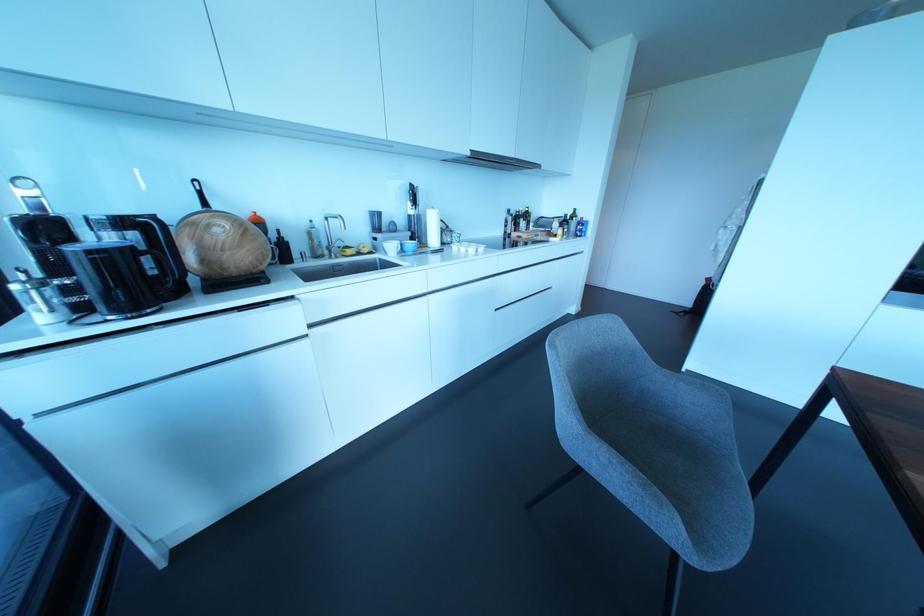
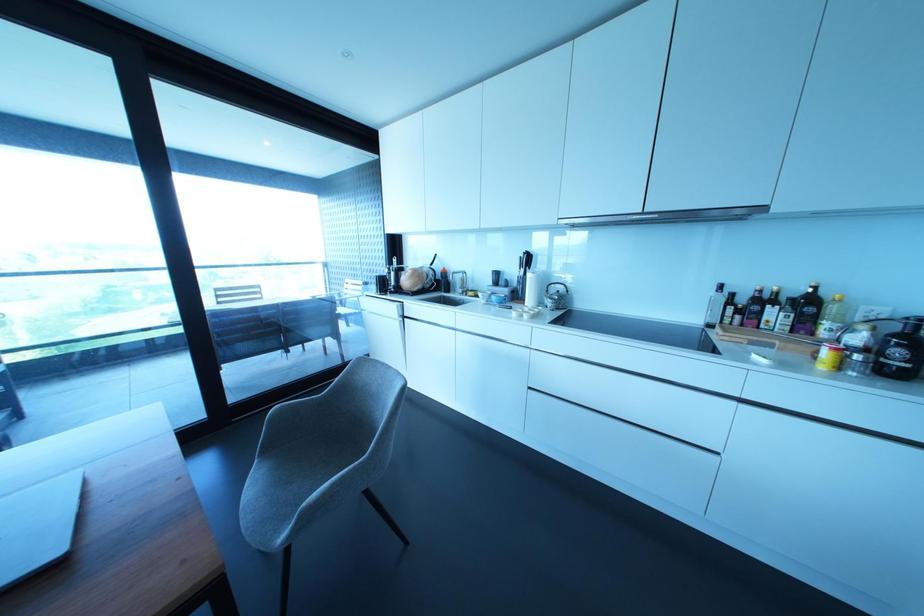
In the second image, find the point that corresponds to the point at 517,223 in the first image.

(760, 313)